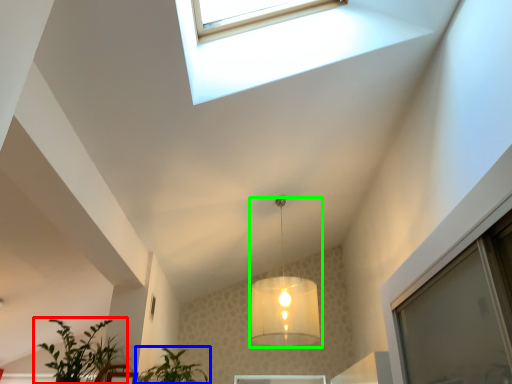
Question: Which is nearer to the houseplant (highlighted by a red box)? houseplant (highlighted by a blue box) or lamp (highlighted by a green box).

Choices:
 (A) houseplant
 (B) lamp

Answer: (A)